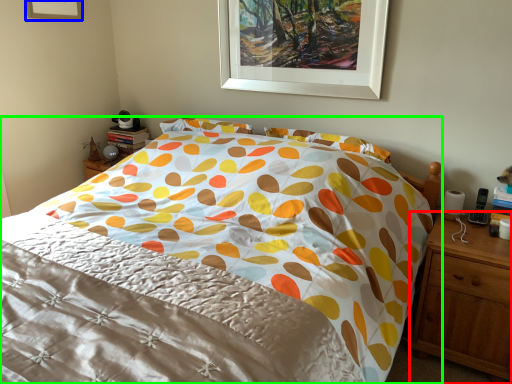
Question: Estimate the real-world distances between objects in this image. Which object is closer to nightstand (highlighted by a red box), picture frame (highlighted by a blue box) or bed (highlighted by a green box)?

Choices:
 (A) picture frame
 (B) bed

Answer: (B)